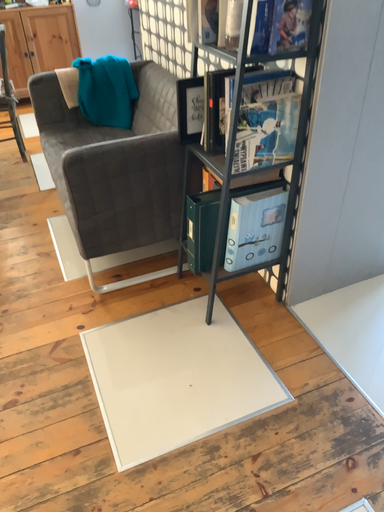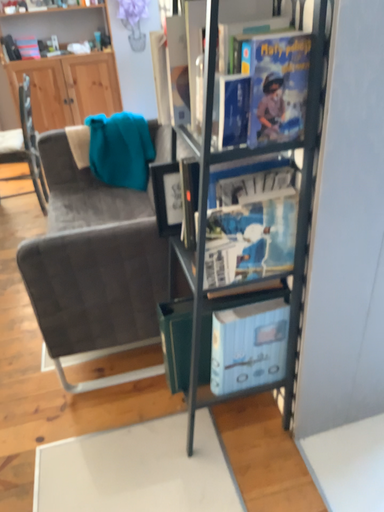
Question: How did the camera likely rotate when shooting the video?

Choices:
 (A) rotated right
 (B) rotated left

Answer: (B)